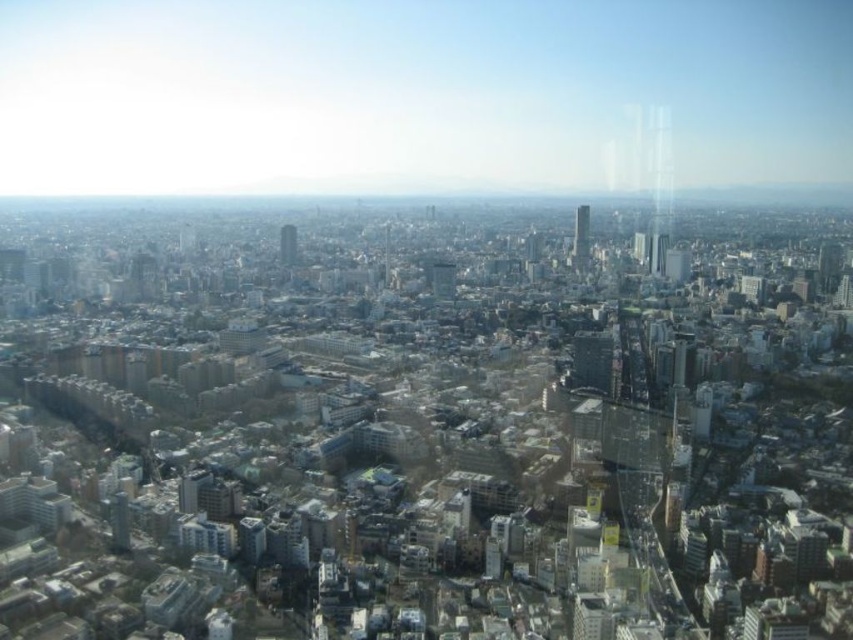
Question: Which of the following is the farthest from the observer?

Choices:
 (A) (283, 260)
 (B) (585, 243)

Answer: (B)

Question: Does green glass skyscraper at center have a lesser width compared to glassy skyscraper at center?

Choices:
 (A) yes
 (B) no

Answer: (A)

Question: Where is green glass skyscraper at center located in relation to glassy skyscraper at center in the image?

Choices:
 (A) above
 (B) below

Answer: (B)

Question: Does green glass skyscraper at center have a larger size compared to glassy skyscraper at center?

Choices:
 (A) yes
 (B) no

Answer: (B)